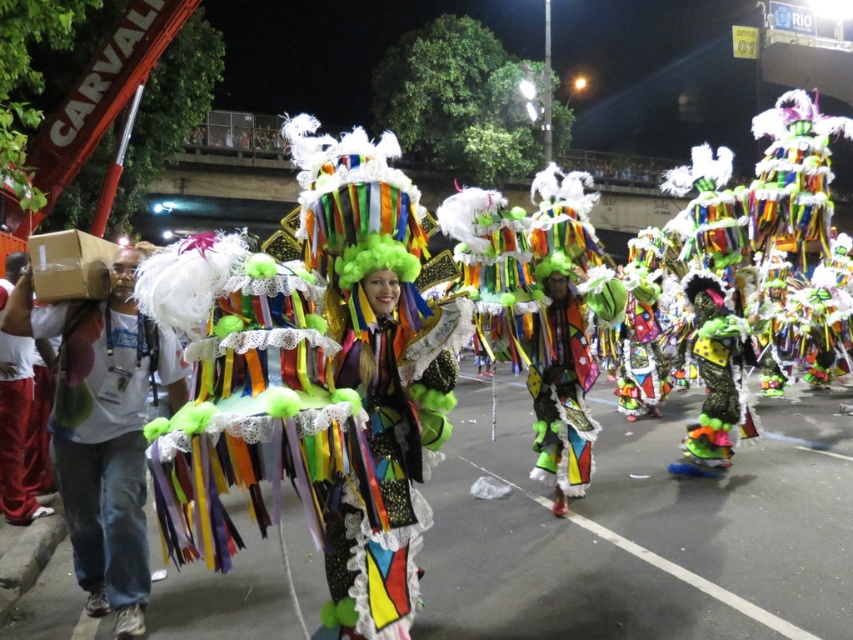
Is brown cardboard box at left thinner than velvet red pants at left?

No, brown cardboard box at left is not thinner than velvet red pants at left.

Can you confirm if brown cardboard box at left is positioned above velvet red pants at left?

Indeed, brown cardboard box at left is positioned over velvet red pants at left.

Image resolution: width=853 pixels, height=640 pixels. What do you see at coordinates (103, 429) in the screenshot?
I see `brown cardboard box at left` at bounding box center [103, 429].

Where is `brown cardboard box at left`? Image resolution: width=853 pixels, height=640 pixels. brown cardboard box at left is located at coordinates (103, 429).